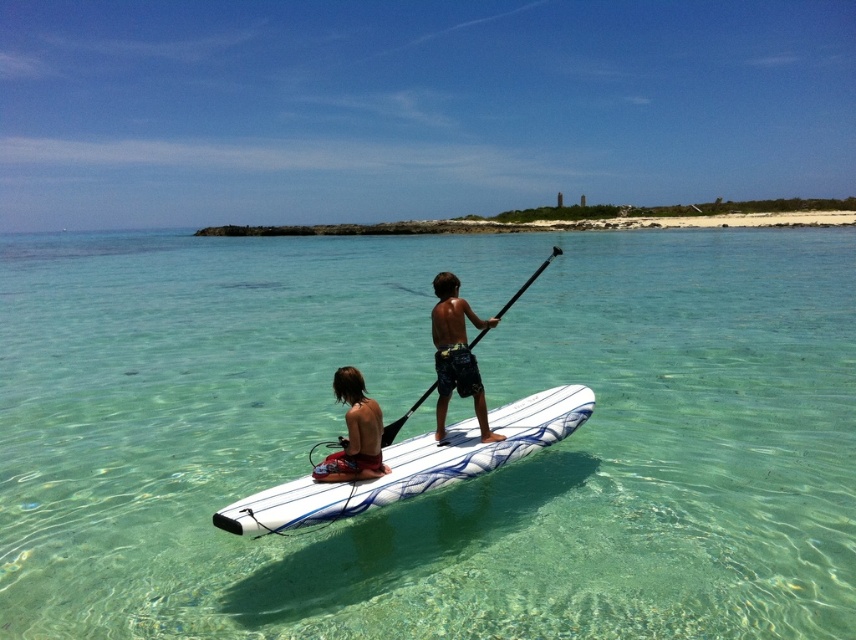
Question: Can you confirm if clear glassy water at center is thinner than dark blue board shorts at center?

Choices:
 (A) no
 (B) yes

Answer: (A)

Question: Is matte red shorts at lower left smaller than black matte paddle at center?

Choices:
 (A) yes
 (B) no

Answer: (A)

Question: Which point appears closest to the camera in this image?

Choices:
 (A) (241, 513)
 (B) (452, 339)
 (C) (506, 301)

Answer: (A)

Question: Which point appears farthest from the camera in this image?

Choices:
 (A) (452, 305)
 (B) (388, 438)
 (C) (462, 440)
 (D) (795, 634)

Answer: (C)

Question: Is the position of matte red shorts at lower left less distant than that of black matte paddle at center?

Choices:
 (A) yes
 (B) no

Answer: (A)

Question: Which of the following is the farthest from the observer?

Choices:
 (A) clear glassy water at center
 (B) matte red shorts at lower left

Answer: (B)